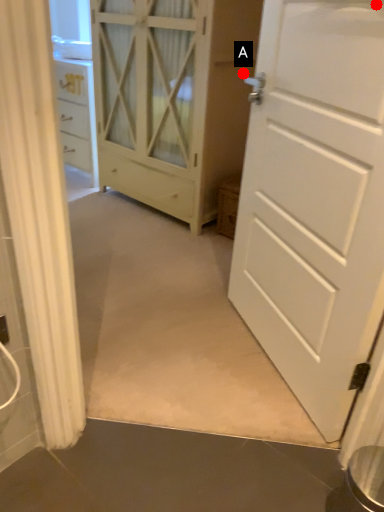
Question: Two points are circled on the image, labeled by A and B beside each circle. Which point is farther from the camera taking this photo?

Choices:
 (A) A is further
 (B) B is further

Answer: (A)